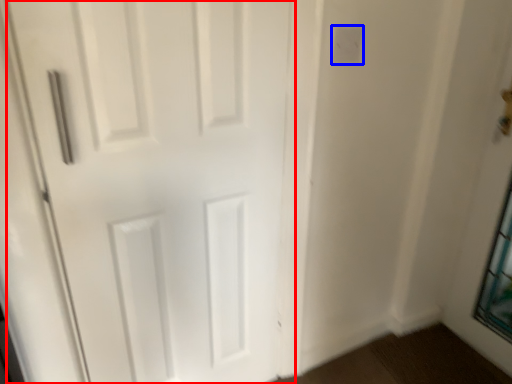
Question: Among these objects, which one is farthest to the camera, door (highlighted by a red box) or electric outlet (highlighted by a blue box)?

Choices:
 (A) door
 (B) electric outlet

Answer: (B)